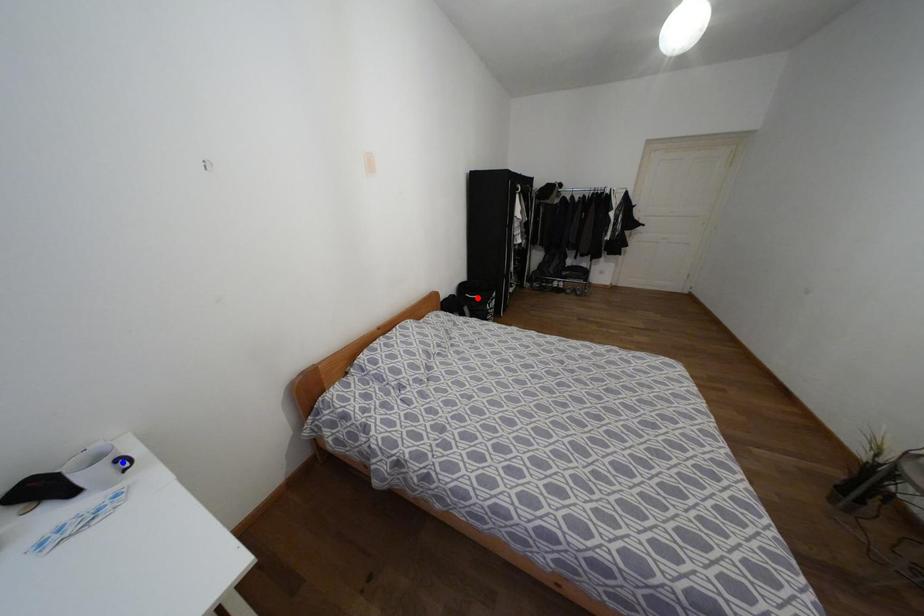
Question: In the image, two points are highlighted. Which point is nearer to the camera? Reply with the corresponding letter.

Choices:
 (A) blue point
 (B) red point

Answer: (A)